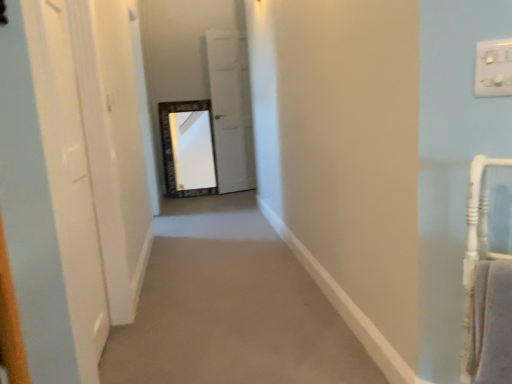
Question: Is point (478, 79) positioned closer to the camera than point (14, 132)?

Choices:
 (A) farther
 (B) closer

Answer: (A)

Question: Relative to white glossy door at left, the second door positioned from the right, is white plastic switch at upper right in front or behind?

Choices:
 (A) front
 (B) behind

Answer: (A)

Question: Which of these objects is positioned farthest from the white glossy door at left, marked as the 1th door in a left-to-right arrangement?

Choices:
 (A) white plastic switch at upper right
 (B) white matte door at center, the 2th door in the left-to-right sequence

Answer: (B)

Question: Based on their relative distances, which object is farther from the white glossy door at left, acting as the first door starting from the front?

Choices:
 (A) white matte door at center, the first door when ordered from back to front
 (B) white plastic switch at upper right

Answer: (A)